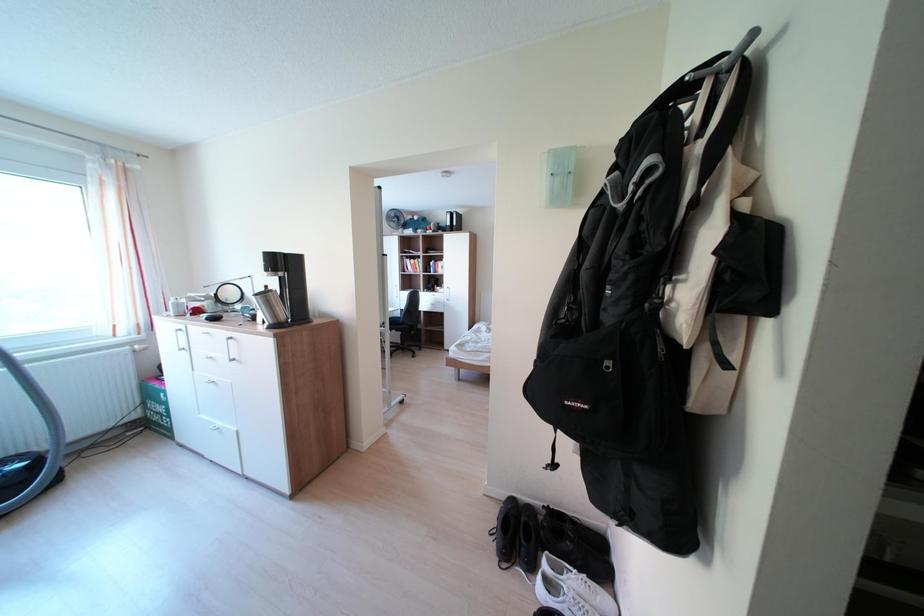
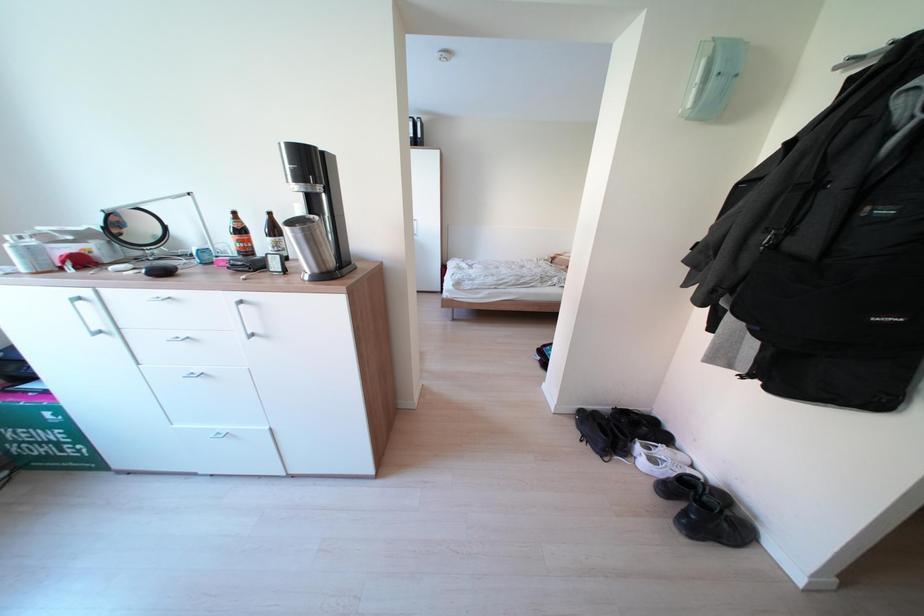
Which direction would the cameraman need to move to produce the second image?

The cameraman moved toward left, forward.